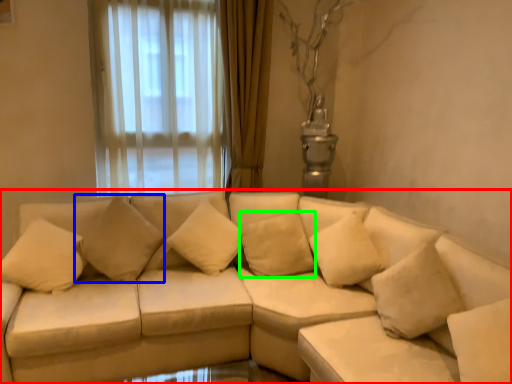
Question: Based on their relative distances, which object is farther from studio couch (highlighted by a red box)? Choose from pillow (highlighted by a blue box) and pillow (highlighted by a green box).

Choices:
 (A) pillow
 (B) pillow

Answer: (A)